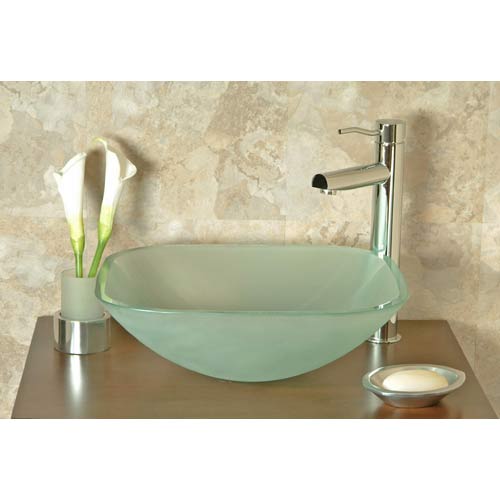
Find the location of a particular element. plant is located at coordinates (115, 194).